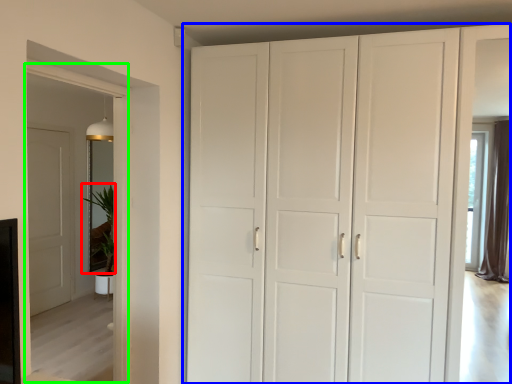
Question: Which object is positioned closest to plant (highlighted by a red box)? Select from cupboard (highlighted by a blue box) and glass door (highlighted by a green box).

Choices:
 (A) cupboard
 (B) glass door

Answer: (B)